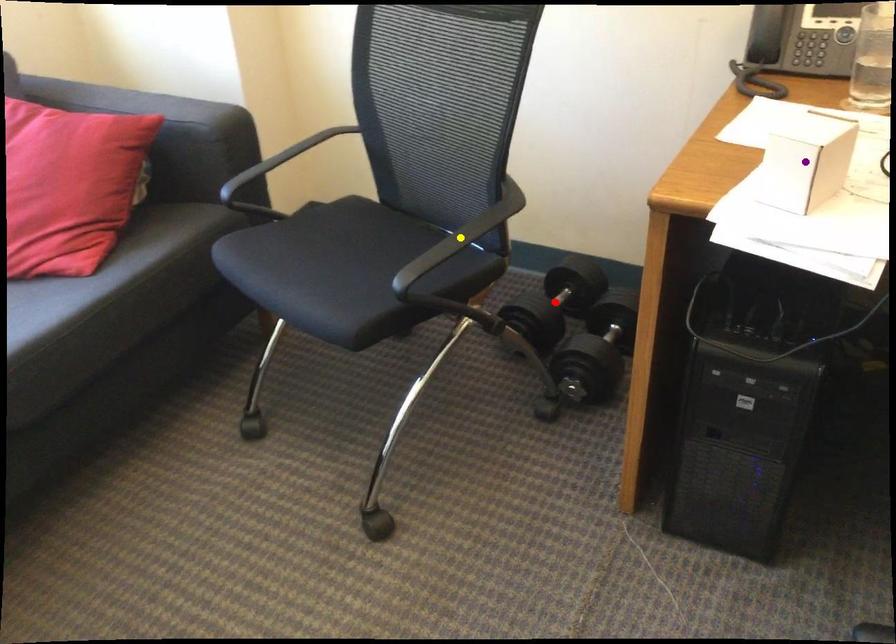
Order these from nearest to farthest:
A) purple point
B) red point
C) yellow point

1. purple point
2. yellow point
3. red point